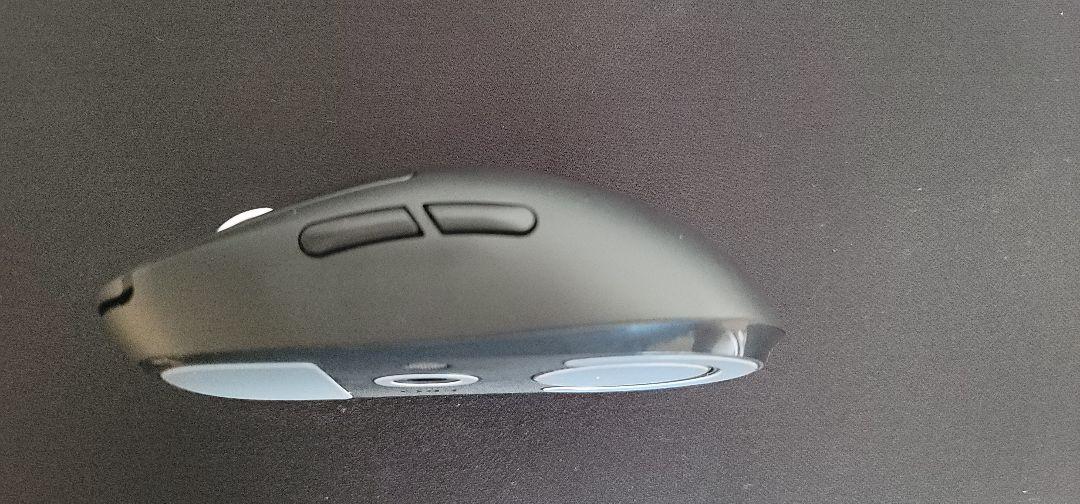
Locate an element on the screen. The width and height of the screenshot is (1080, 504). white light is located at coordinates (241, 215), (229, 222).